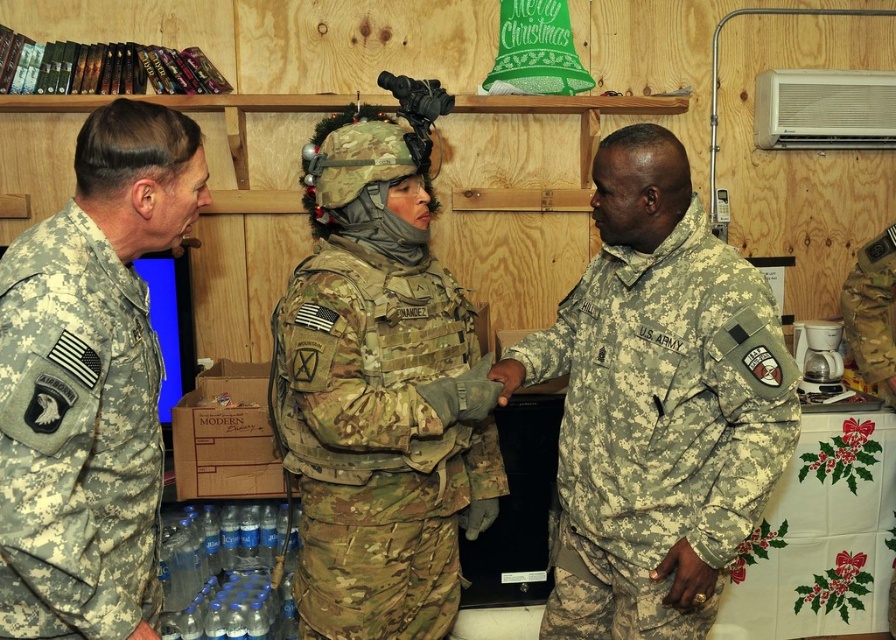
You are a photographer positioned to the side of the scene. You need to capture a photo that includes both the camouflage fabric us army uniform at center and the camouflage fabric uniform at center. Considering their positions, which one is closer to the edge of the frame so you can adjust your angle accordingly?

The camouflage fabric uniform at center is closer to the edge of the frame because it is positioned to the side of the camouflage fabric us army uniform at center, which is centrally located.

You are a drone operator trying to identify two points in a military scene. The first point is at coordinates point [789,451] and the second is at point [437,513]. Which point is closer to the camera?

Point [789,451] is closer to the camera than point [437,513].

You are standing at point (15, 304) and want to move to point (699, 272). Is the path clear? Please explain.

Point (699, 272) is behind point (15, 304), so the path might be blocked by the object at point (15, 304).